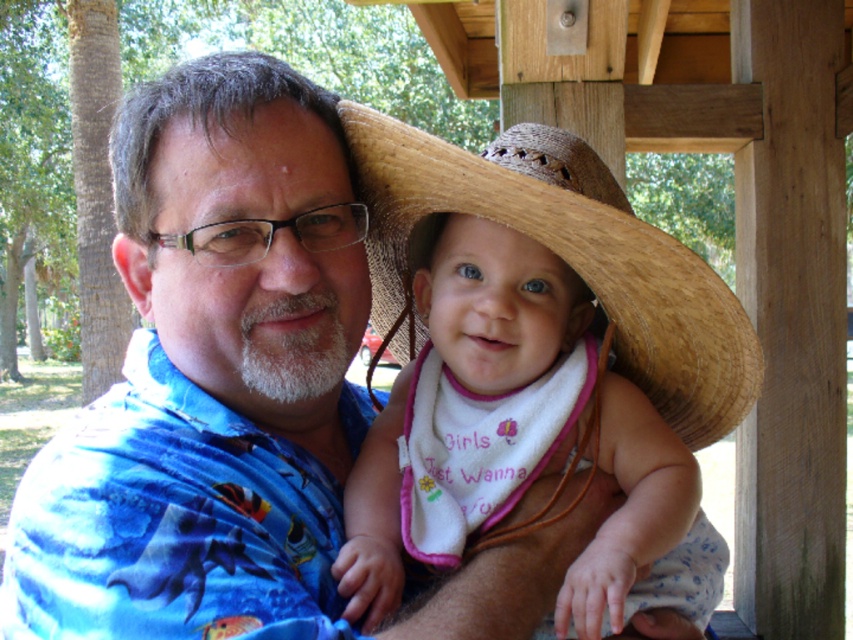
Question: Is the position of white cotton bib at center less distant than that of woven straw sombrero at center?

Choices:
 (A) yes
 (B) no

Answer: (A)

Question: Which point is farther from the camera taking this photo?

Choices:
 (A) (556, 193)
 (B) (686, 557)

Answer: (B)

Question: Does white cotton bib at center have a smaller size compared to woven straw sombrero at center?

Choices:
 (A) yes
 (B) no

Answer: (A)

Question: From the image, what is the correct spatial relationship of white cotton bib at center in relation to woven straw sombrero at center?

Choices:
 (A) above
 (B) below

Answer: (B)